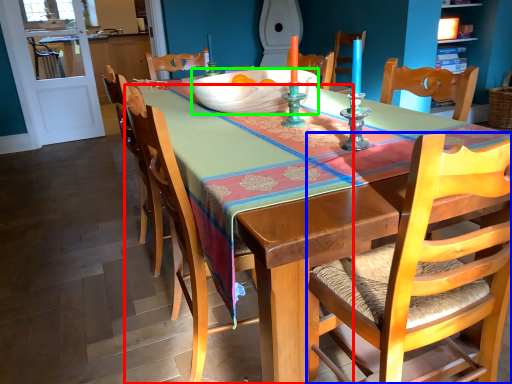
Question: Which object is positioned closest to chair (highlighted by a red box)? Select from chair (highlighted by a blue box) and bowl (highlighted by a green box).

Choices:
 (A) chair
 (B) bowl

Answer: (B)